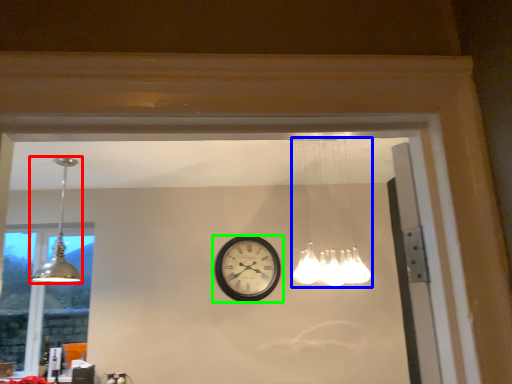
Question: Estimate the real-world distances between objects in this image. Which object is farther from lamp (highlighted by a red box), lamp (highlighted by a blue box) or wall clock (highlighted by a green box)?

Choices:
 (A) lamp
 (B) wall clock

Answer: (A)